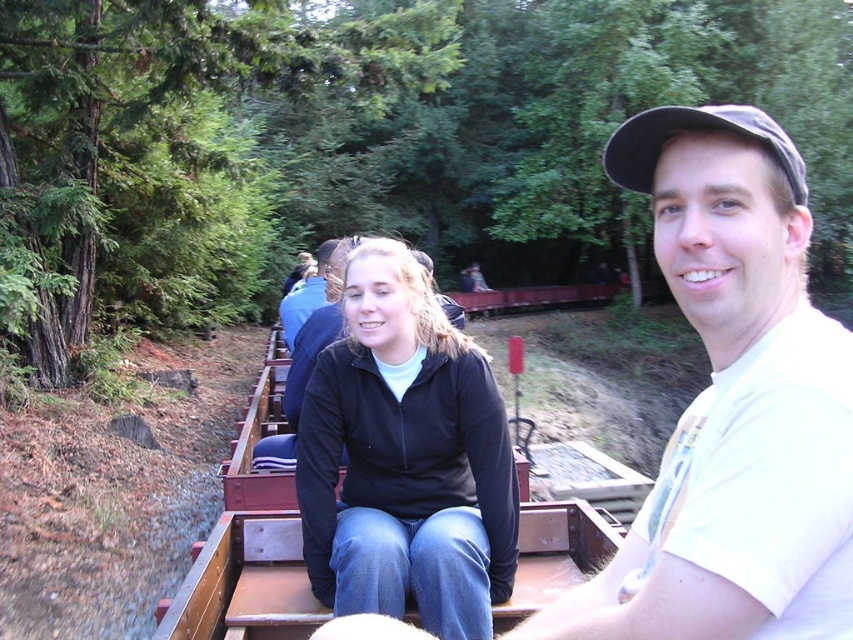
Question: Is white cotton shirt at center in front of black matte jacket at center?

Choices:
 (A) no
 (B) yes

Answer: (B)

Question: Which of the following is the farthest from the observer?

Choices:
 (A) black fabric cap at upper right
 (B) white cotton shirt at center
 (C) black matte jacket at center

Answer: (C)

Question: Which is nearer to the black matte jacket at center?

Choices:
 (A) black fabric cap at upper right
 (B) white cotton shirt at center

Answer: (B)

Question: Does black matte jacket at center appear under black fabric cap at upper right?

Choices:
 (A) yes
 (B) no

Answer: (A)

Question: Which object is farther from the camera taking this photo?

Choices:
 (A) black fabric cap at upper right
 (B) white cotton shirt at center

Answer: (A)

Question: Does black matte jacket at center appear on the left side of black fabric cap at upper right?

Choices:
 (A) no
 (B) yes

Answer: (B)